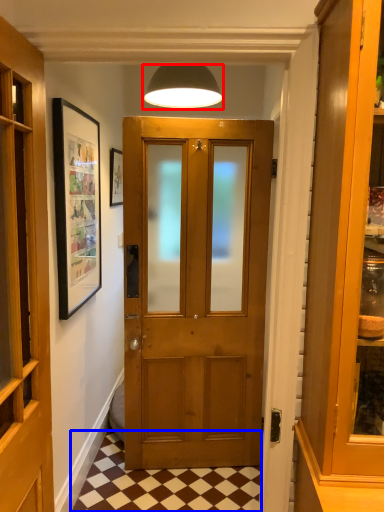
Question: Which point is closer to the camera, lamp (highlighted by a red box) or tile (highlighted by a blue box)?

Choices:
 (A) lamp
 (B) tile

Answer: (B)